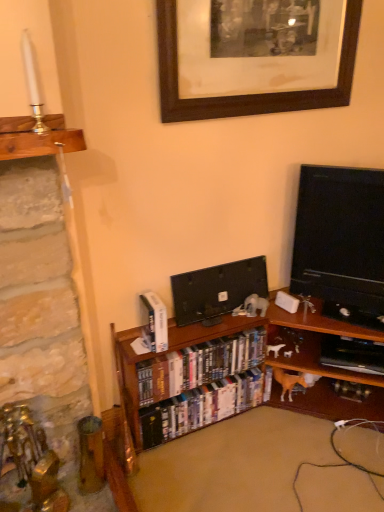
Find the location of a particular element. vacant area situated below wooden bookcase at center (from a real-world perspective) is located at coordinates (290, 458).